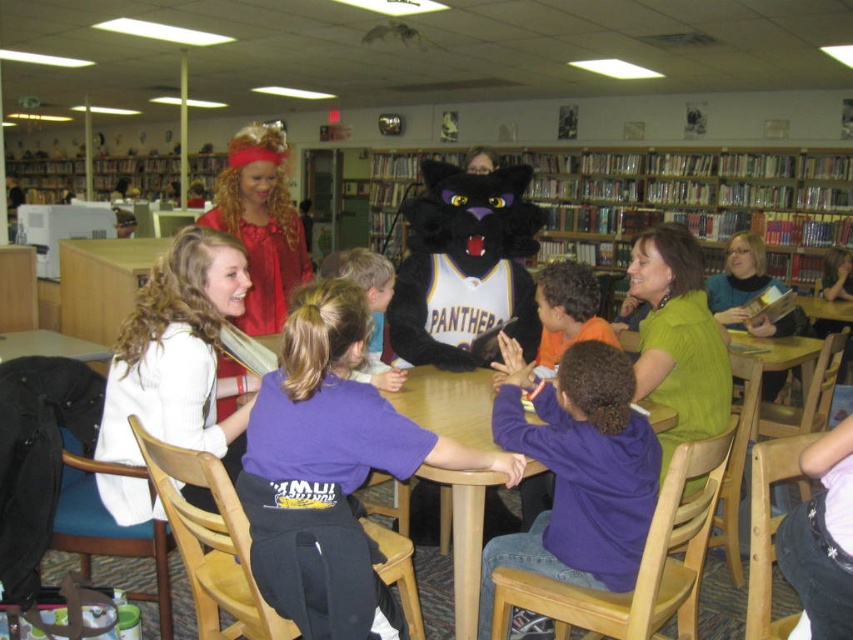
Consider the image. Who is more forward, (x=300, y=420) or (x=186, y=433)?

Point (x=300, y=420) is more forward.

Which is in front, point (347, 323) or point (192, 237)?

Point (347, 323) is in front.

This screenshot has width=853, height=640. I want to click on purple cotton shirt at center, so click(x=328, y=465).

Does wooden bookshelf at center appear on the left side of fuzzy black panther at center?

In fact, wooden bookshelf at center is to the right of fuzzy black panther at center.

Consider the image. Is wooden bookshelf at center wider than fuzzy black panther at center?

Yes.

At what (x,y) coordinates should I click in order to perform the action: click on wooden bookshelf at center. Please return your answer as a coordinate pair (x, y). Looking at the image, I should click on (694, 202).

The height and width of the screenshot is (640, 853). Identify the location of wooden bookshelf at center. (694, 202).

Which is in front, point (283, 602) or point (416, 241)?

Point (283, 602)

Which is behind, point (318, 580) or point (520, 291)?

Point (520, 291)

This screenshot has width=853, height=640. Identify the location of purple cotton shirt at center. (328, 465).